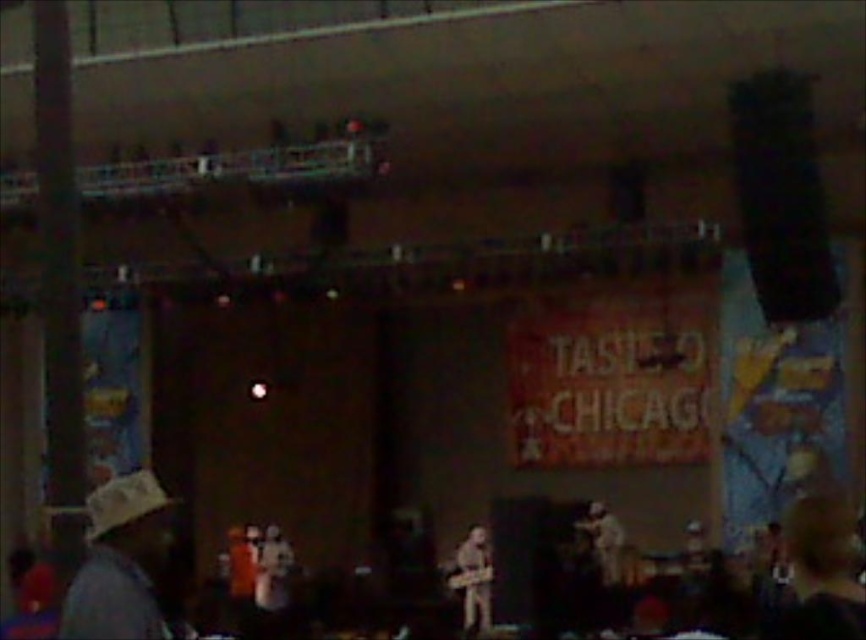
Is khaki fabric hat at lower left to the left of brown leather guitar at center from the viewer's perspective?

Correct, you'll find khaki fabric hat at lower left to the left of brown leather guitar at center.

Does khaki fabric hat at lower left have a greater width compared to brown leather guitar at center?

Incorrect, khaki fabric hat at lower left's width does not surpass brown leather guitar at center's.

Locate an element on the screen. The image size is (866, 640). khaki fabric hat at lower left is located at coordinates (120, 563).